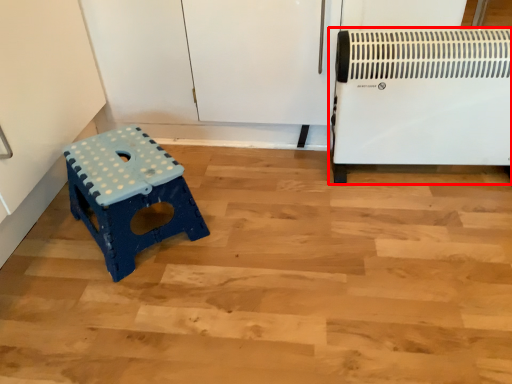
Question: Observing the image, what is the correct spatial positioning of home appliance (annotated by the red box) in reference to furniture?

Choices:
 (A) left
 (B) right

Answer: (B)